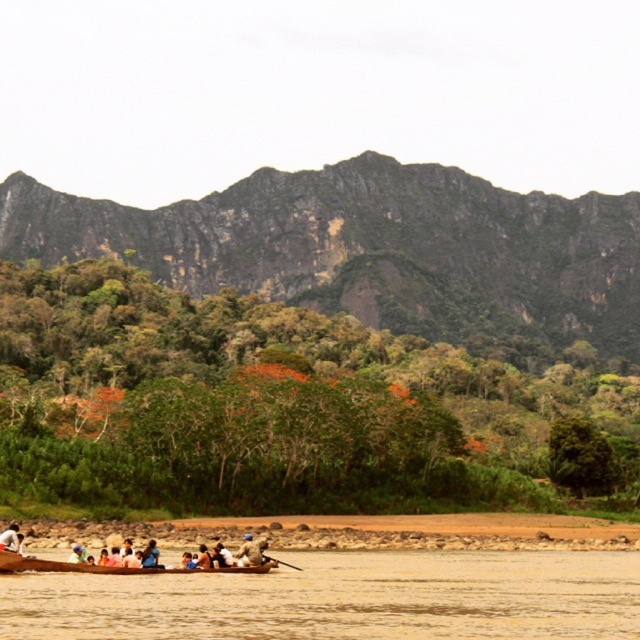
Question: Does brown muddy water at lower center appear on the right side of white fabric person at lower left?

Choices:
 (A) yes
 (B) no

Answer: (A)

Question: Based on their relative distances, which object is farther from the wooden paddle at lower center?

Choices:
 (A) white fabric person at lower left
 (B) rugged rock mountain at upper center

Answer: (B)

Question: Considering the relative positions of rugged rock mountain at upper center and brown muddy water at lower center in the image provided, where is rugged rock mountain at upper center located with respect to brown muddy water at lower center?

Choices:
 (A) below
 (B) above

Answer: (B)

Question: Where is wooden canoe at lower center located in relation to white fabric person at lower left in the image?

Choices:
 (A) right
 (B) left

Answer: (A)

Question: Estimate the real-world distances between objects in this image. Which object is farther from the wooden canoe at lower center?

Choices:
 (A) rugged rock mountain at upper center
 (B) white fabric person at lower left
 (C) wooden paddle at lower center
 (D) brown leather boat at lower center

Answer: (A)

Question: Among these objects, which one is farthest from the camera?

Choices:
 (A) white fabric person at lower left
 (B) brown muddy water at lower center
 (C) rugged rock mountain at upper center
 (D) wooden canoe at lower center

Answer: (C)